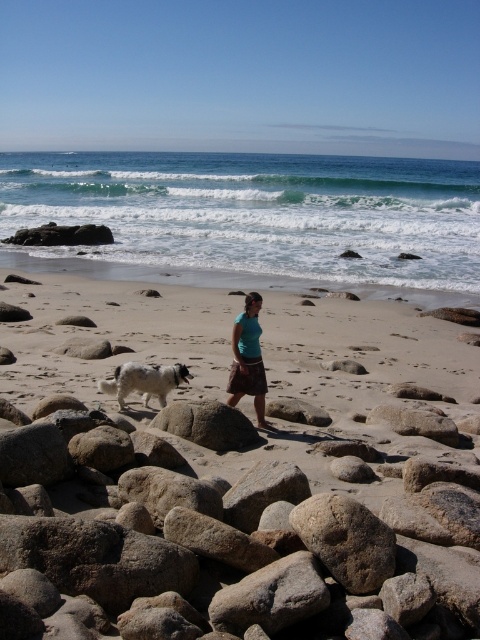
Can you confirm if sandy beach at lower center is shorter than white fluffy dog at center?

Incorrect, sandy beach at lower center's height does not fall short of white fluffy dog at center's.

Who is more distant from viewer, (x=410, y=262) or (x=152, y=388)?

Positioned behind is point (x=410, y=262).

Image resolution: width=480 pixels, height=640 pixels. Describe the element at coordinates (266, 275) in the screenshot. I see `sandy beach at lower center` at that location.

Where is `sandy beach at lower center`? sandy beach at lower center is located at coordinates (266, 275).

Which is behind, point (242, 420) or point (233, 380)?

The point (233, 380) is more distant.

Is the position of smooth gray rock at center less distant than that of teal fabric skirt at center?

That is True.

Which is behind, point (194, 403) or point (250, 330)?

Positioned behind is point (194, 403).

Locate an element on the screen. The height and width of the screenshot is (640, 480). smooth gray rock at center is located at coordinates (207, 424).

Does smooth sand beach at center have a lesser width compared to sandy beach at lower center?

Yes, smooth sand beach at center is thinner than sandy beach at lower center.

Is point (84, 536) closer to viewer compared to point (228, 273)?

That is True.

Locate an element on the screen. Image resolution: width=480 pixels, height=640 pixels. smooth sand beach at center is located at coordinates (240, 476).